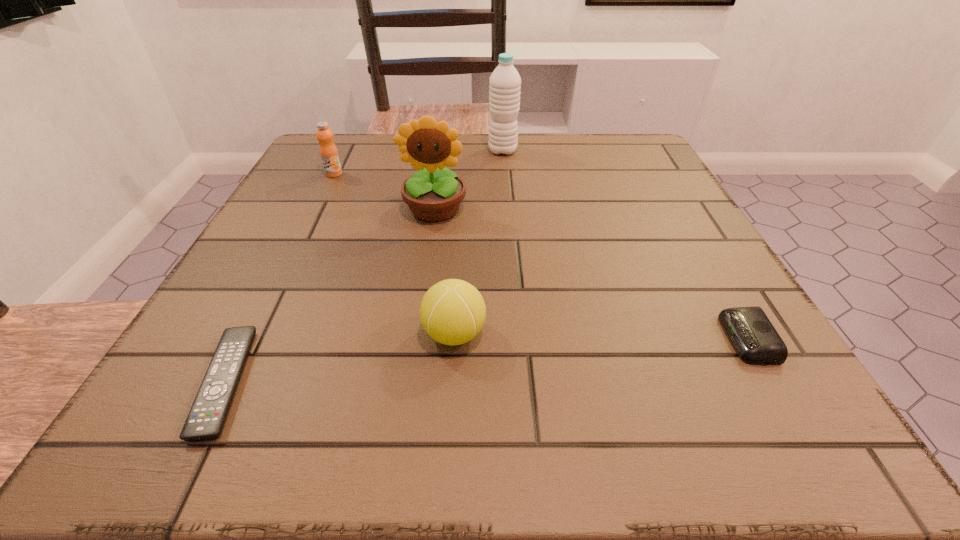
Identify the location of the second object from right to left. The width and height of the screenshot is (960, 540). 505,83.

Identify the location of water bottle. This screenshot has width=960, height=540. (505, 83).

Where is `the fourth nearest object`? The image size is (960, 540). the fourth nearest object is located at coordinates (433, 195).

This screenshot has height=540, width=960. What are the coordinates of `the third tallest object` in the screenshot? It's located at (328, 151).

Find the location of a particular element. The width and height of the screenshot is (960, 540). the fifth nearest object is located at coordinates (328, 151).

Where is `the third shortest object`? the third shortest object is located at coordinates (452, 312).

At what (x,y) coordinates should I click in order to perform the action: click on the fifth tallest object. Please return your answer as a coordinate pair (x, y). Looking at the image, I should click on (753, 336).

Image resolution: width=960 pixels, height=540 pixels. What are the coordinates of `the rightmost object` in the screenshot? It's located at click(753, 336).

You are a GUI agent. You are given a task and a screenshot of the screen. Output one action in this format:
    pyautogui.click(x=<x>, y=<y>)
    Task: Click on the remote control
    The image size is (960, 540).
    Given the screenshot: What is the action you would take?
    pyautogui.click(x=205, y=421)

This screenshot has width=960, height=540. In order to click on vacant area situated 0.380m on the front of the fifth object from left to right in this screenshot , I will do `click(512, 256)`.